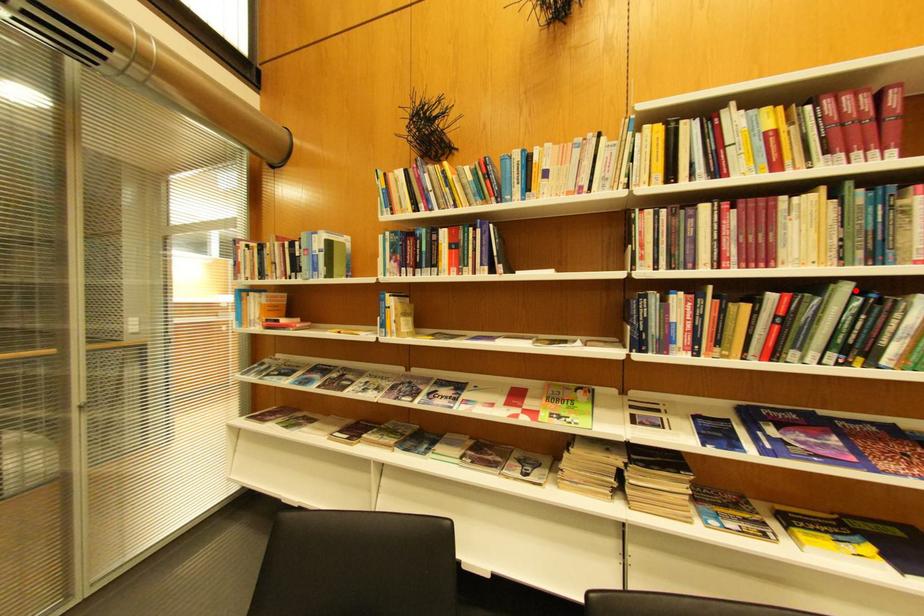
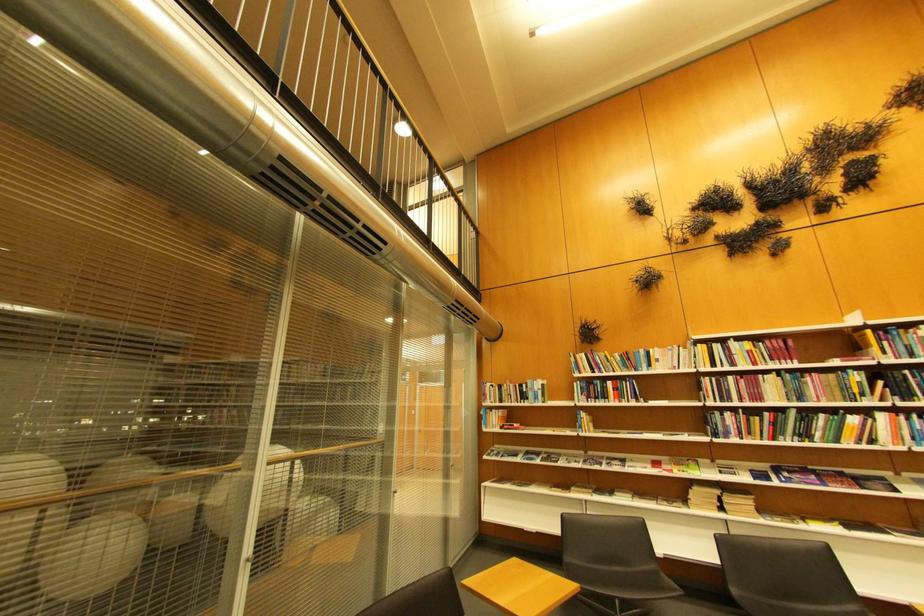
Find the pixel in the second image that matches the highlighted location in the first image.

(804, 413)